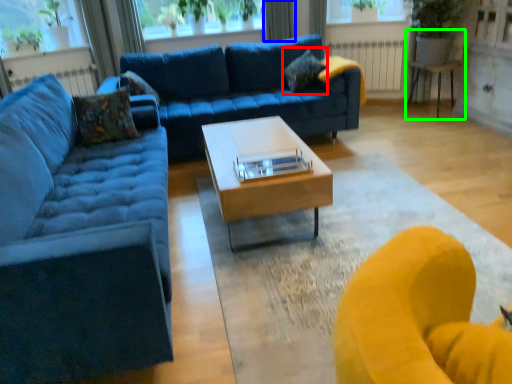
Question: Estimate the real-world distances between objects in this image. Which object is closer to pillow (highlighted by a red box), curtain (highlighted by a blue box) or swivel chair (highlighted by a green box)?

Choices:
 (A) curtain
 (B) swivel chair

Answer: (B)